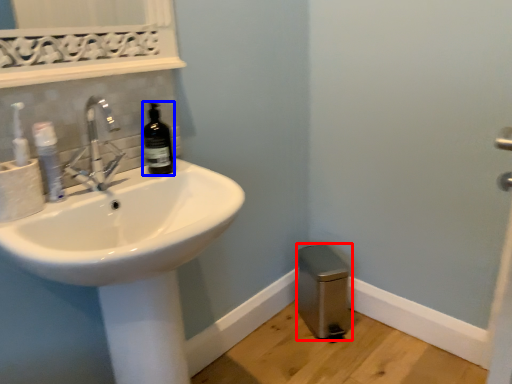
Question: Which object is further to the camera taking this photo, bidet (highlighted by a red box) or bottle (highlighted by a blue box)?

Choices:
 (A) bidet
 (B) bottle

Answer: (A)